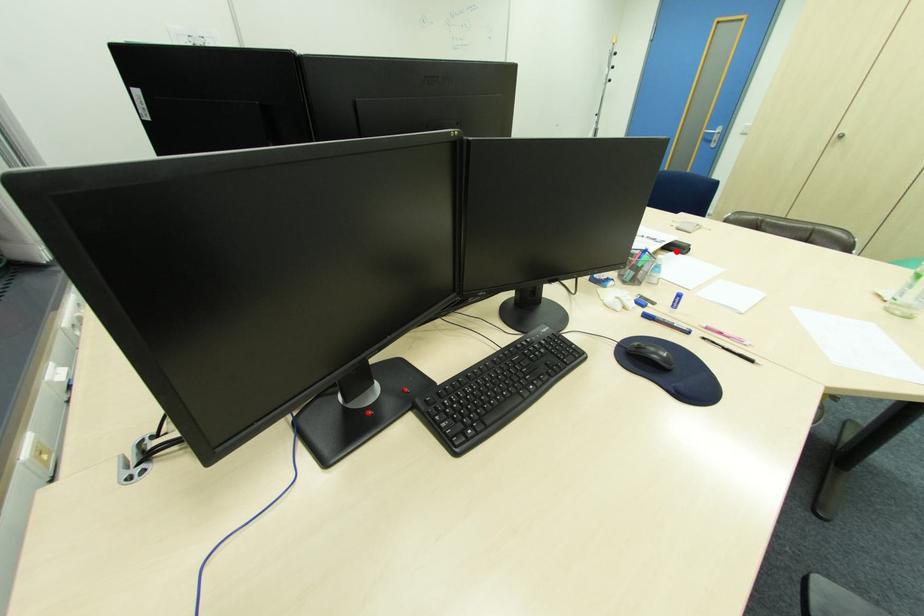
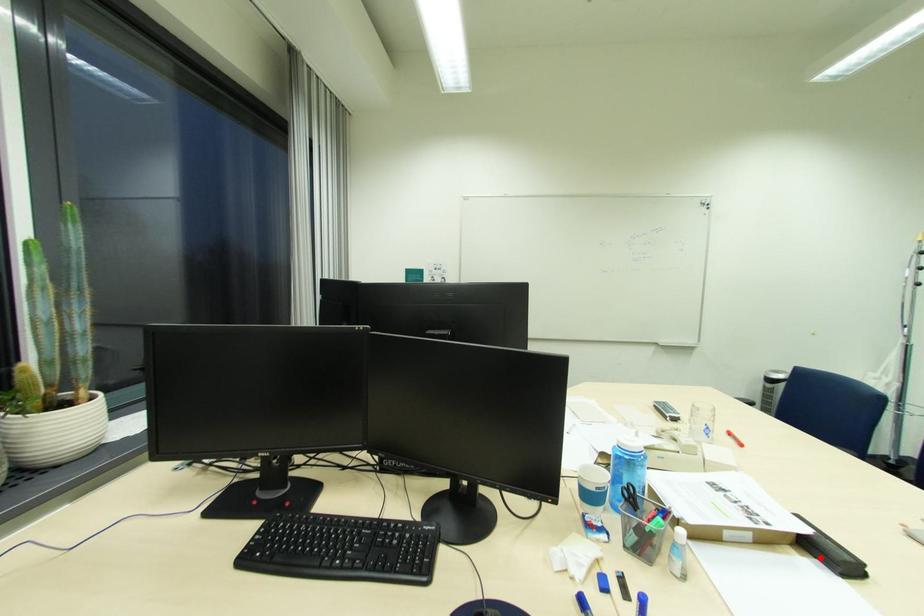
I am providing you with two images of the same scene from different viewpoints. A red point is marked on the first image and another point is marked on the second image. Is the red point in image1 aligned with the point shown in image2?

Yes